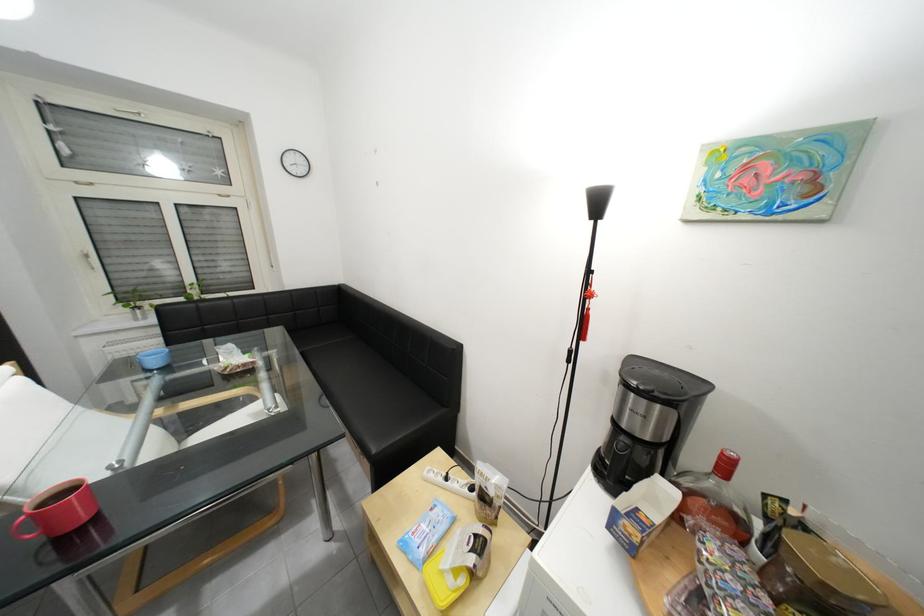
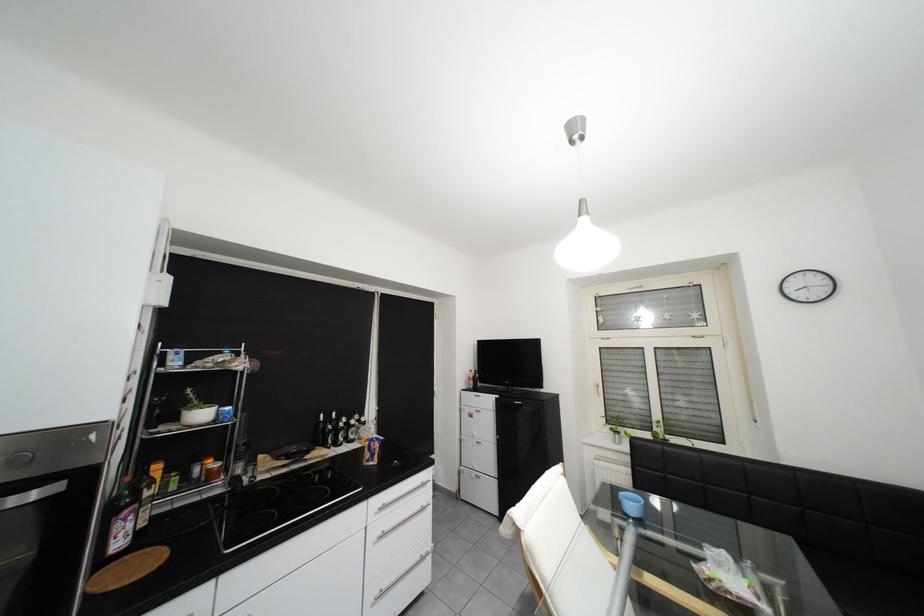
Question: The camera is either moving clockwise (left) or counter-clockwise (right) around the object. The first image is from the beginning of the video and the second image is from the end. Is the camera moving left or right when shooting the video?

Choices:
 (A) Left
 (B) Right

Answer: (B)